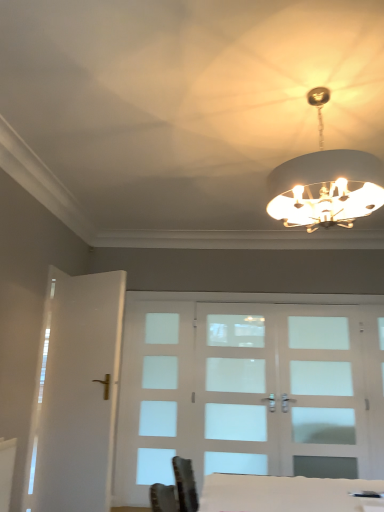
The width and height of the screenshot is (384, 512). I want to click on vacant area on top of white frosted glass door at center, the 3th screen door when ordered from left to right (from a real-world perspective), so click(324, 300).